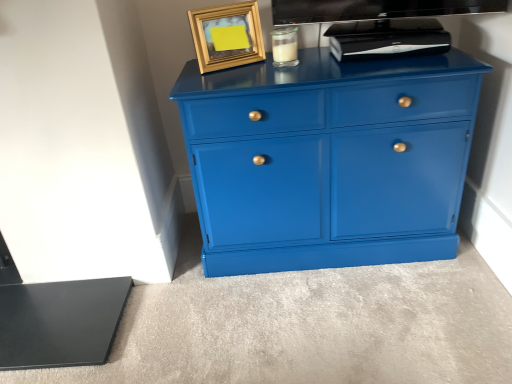
At what (x,y) coordinates should I click in order to perform the action: click on free space to the right of gold metallic picture frame at upper center. Please return your answer as a coordinate pair (x, y). The height and width of the screenshot is (384, 512). Looking at the image, I should click on (273, 67).